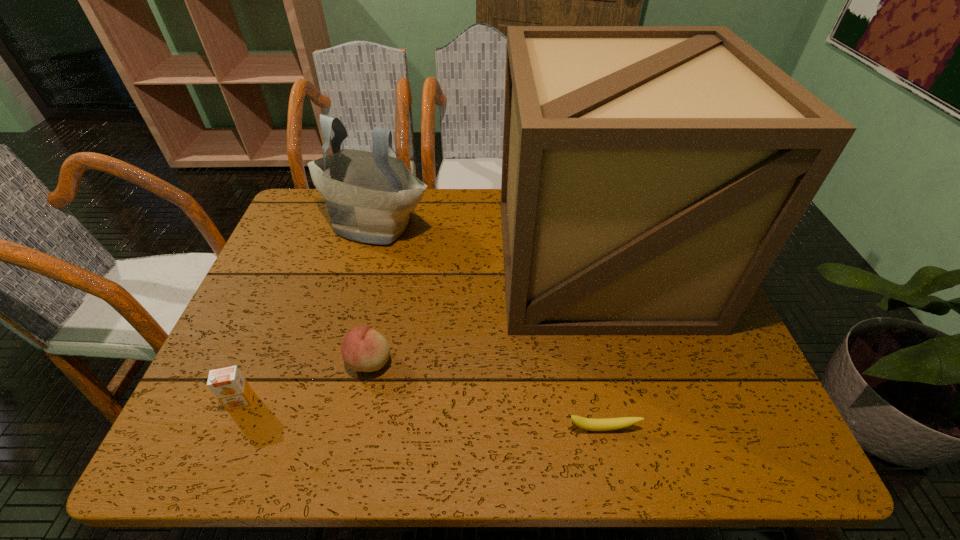
Locate an element on the screen. vacant space at the left edge of the desktop is located at coordinates (282, 282).

Identify the location of vacant space at the right edge. The width and height of the screenshot is (960, 540). (755, 403).

This screenshot has width=960, height=540. I want to click on vacant space at the far left corner, so click(292, 225).

Locate an element on the screen. Image resolution: width=960 pixels, height=540 pixels. free region at the near right corner of the desktop is located at coordinates click(744, 443).

This screenshot has width=960, height=540. Find the location of `free space between the third nearest object and the fourth farthest object`. free space between the third nearest object and the fourth farthest object is located at coordinates (305, 381).

Where is `vacant space in between the second tallest object and the shortest object`? vacant space in between the second tallest object and the shortest object is located at coordinates (489, 326).

Identify the location of unoccupied area between the third nearest object and the nearest object. The width and height of the screenshot is (960, 540). (486, 394).

Identify the location of free space between the third nearest object and the second tallest object. The image size is (960, 540). (372, 293).

You are a GUI agent. You are given a task and a screenshot of the screen. Output one action in this format:
    pyautogui.click(x=<x>, y=<y>)
    Task: Click on the free space between the nearest object and the orange juice
    
    Given the screenshot: What is the action you would take?
    pyautogui.click(x=421, y=415)

At what (x,y) coordinates should I click in order to perform the action: click on free space between the third farthest object and the tallest object. Please return your answer as a coordinate pair (x, y). The height and width of the screenshot is (540, 960). Looking at the image, I should click on (484, 310).